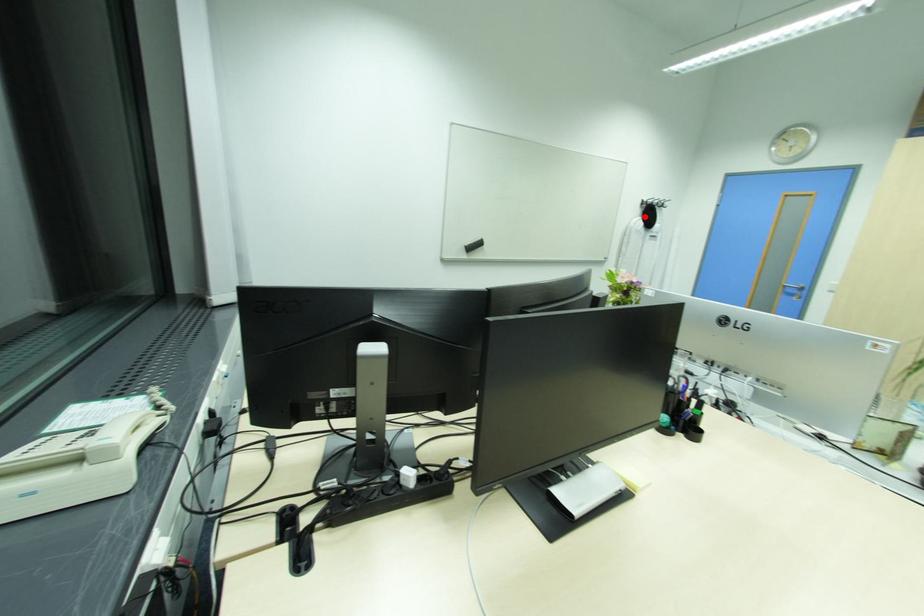
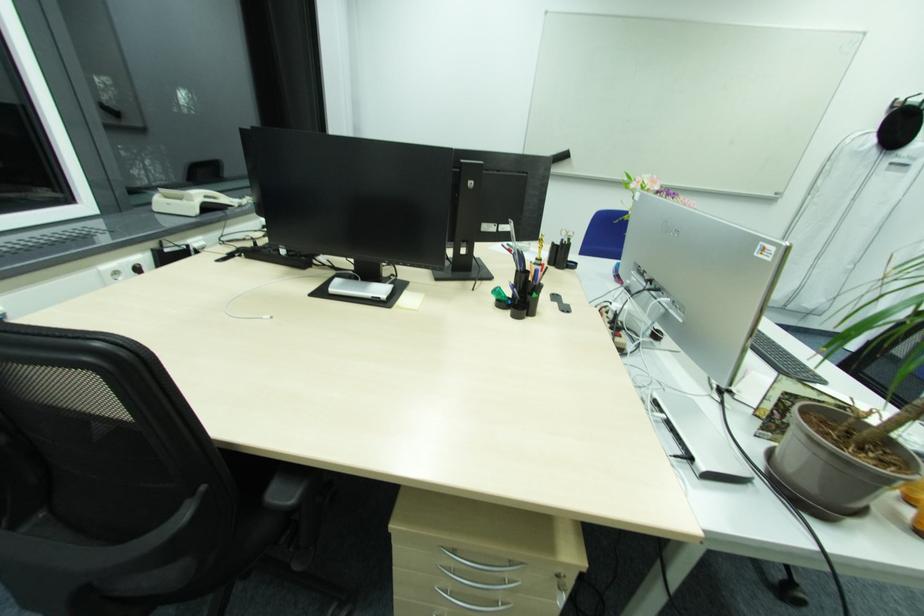
Question: I am providing you with two images of the same scene from different viewpoints. Given a red point in image1, look at the same physical point in image2. Is it:

Choices:
 (A) Closer to the viewpoint
 (B) Farther from the viewpoint

Answer: (B)